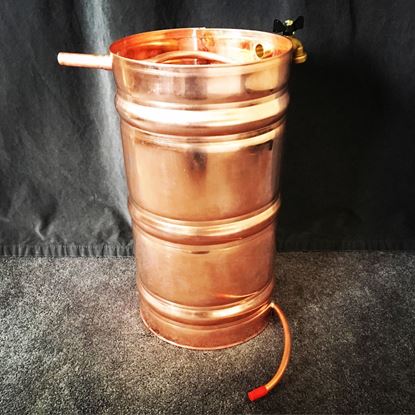
Where is `bronze bucket`? This screenshot has height=415, width=415. bronze bucket is located at coordinates (230, 133).